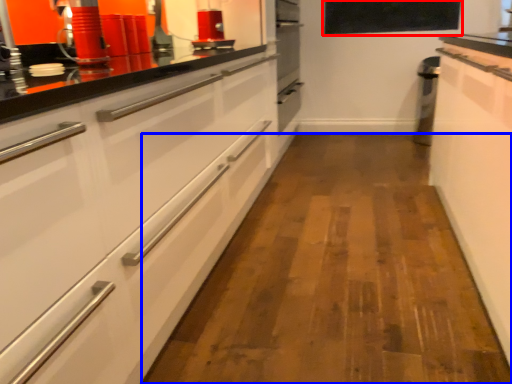
Question: Among these objects, which one is farthest to the camera, window screen (highlighted by a red box) or plain (highlighted by a blue box)?

Choices:
 (A) window screen
 (B) plain

Answer: (A)